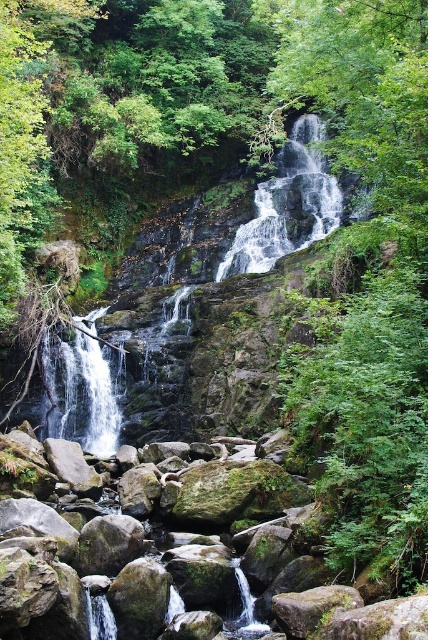
You are a hiker who wants to cross the rocky stream below the waterfall. You notice two points marked on the map as point 1 at coordinates point (x=98, y=342) and point 2 at coordinates point (x=258, y=250). Which point is closer to you when standing at the waterfall viewing area?

Point (x=98, y=342) is in front of point (x=258, y=250), so it is closer to you when standing at the waterfall viewing area.

You are a hiker who wants to cross the stream safely. You notice two areas of white frothy water in the image. Which area, the white frothy water at center or the white frothy water at left, is located higher up the waterfall and might be a safer path to cross?

Result: The white frothy water at center is positioned over the white frothy water at left, so the white frothy water at center is higher up the waterfall. However, frothy water typically indicates faster moving water, which may not be the safest path. Consider looking for a calmer section of the stream for safer crossing.